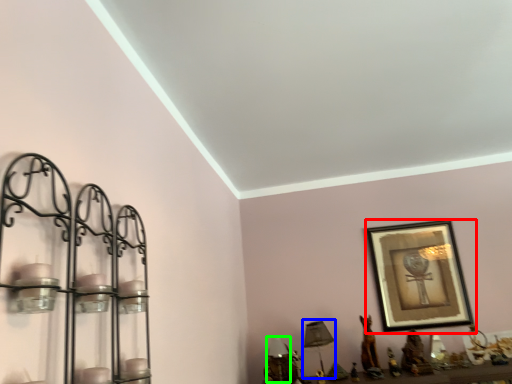
Question: Considering the real-world distances, which object is closest to picture frame (highlighted by a red box)? table lamp (highlighted by a blue box) or table lamp (highlighted by a green box).

Choices:
 (A) table lamp
 (B) table lamp

Answer: (A)